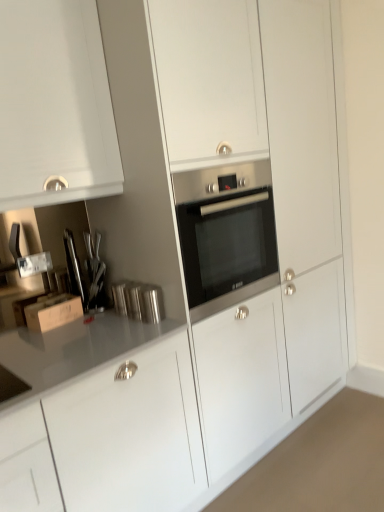
You are a GUI agent. You are given a task and a screenshot of the screen. Output one action in this format:
    pyautogui.click(x=<x>, y=<y>)
    Task: Click on the free point above cardboard box at left (from a real-world perspective)
    This screenshot has width=384, height=512.
    Given the screenshot: What is the action you would take?
    pyautogui.click(x=46, y=297)